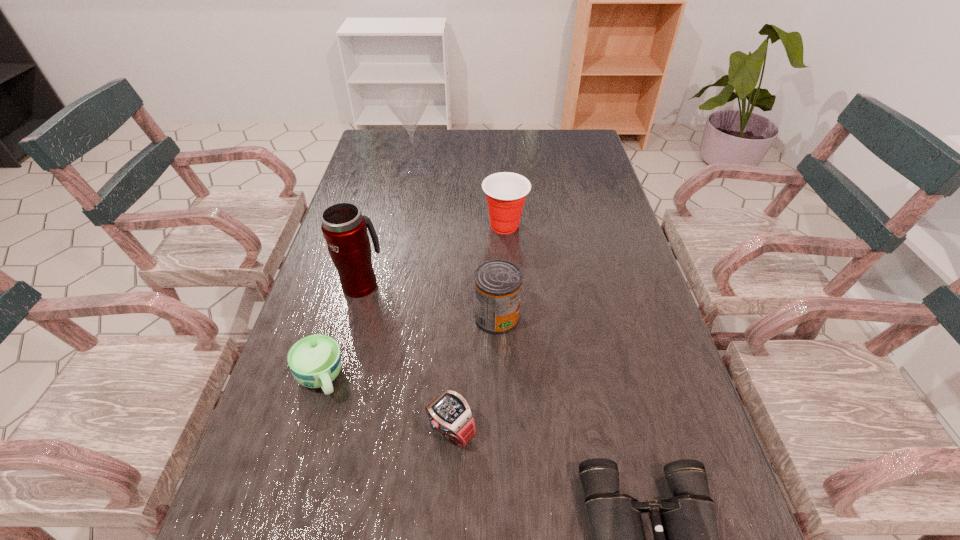
You are a GUI agent. You are given a task and a screenshot of the screen. Output one action in this format:
    pyautogui.click(x=<x>, y=<y>)
    Task: Click on the free region located 0.400m on the side with the handle of the third farthest object
    
    Given the screenshot: What is the action you would take?
    pyautogui.click(x=389, y=183)

This screenshot has height=540, width=960. I want to click on vacant space located on the side with the handle of the third farthest object, so click(382, 207).

You are a GUI agent. You are given a task and a screenshot of the screen. Output one action in this format:
    pyautogui.click(x=<x>, y=<y>)
    Task: Click on the vacant space located on the left of the taller cup
    The height and width of the screenshot is (540, 960).
    Given the screenshot: What is the action you would take?
    pyautogui.click(x=426, y=226)

Locate an element on the screen. This screenshot has width=960, height=540. vacant space located 0.200m on the front of the fourth farthest object is located at coordinates (500, 418).

Where is `vacant space located 0.340m on the back of the watch`? vacant space located 0.340m on the back of the watch is located at coordinates (458, 284).

You are a GUI agent. You are given a task and a screenshot of the screen. Output one action in this format:
    pyautogui.click(x=<x>, y=<y>)
    Task: Click on the vacant space located on the back of the nearer cup
    The image size is (960, 540).
    Given the screenshot: What is the action you would take?
    pyautogui.click(x=347, y=291)

Where is `object located in the far edge section of the desktop`? object located in the far edge section of the desktop is located at coordinates (408, 104).

The image size is (960, 540). I want to click on flute glass that is at the left edge, so click(408, 104).

The height and width of the screenshot is (540, 960). Identify the location of thermos bottle located at the left edge. (x=344, y=228).

At what (x,y) coordinates should I click in order to perform the action: click on cup at the left edge. Please return your answer as a coordinate pair (x, y). This screenshot has height=540, width=960. Looking at the image, I should click on (315, 361).